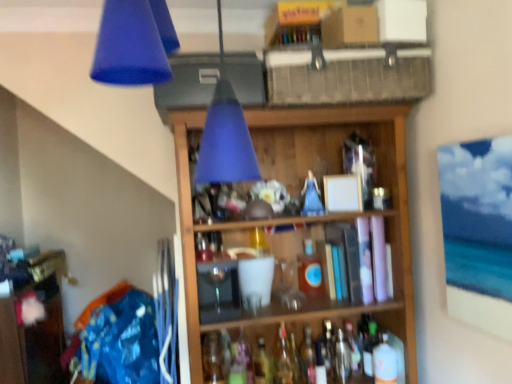
Question: Considering the relative positions of wooden shelf at center and translucent glass wine bottle at center, which appears as the 4th wine bottle when viewed from the right, in the image provided, is wooden shelf at center to the right of translucent glass wine bottle at center, which appears as the 4th wine bottle when viewed from the right, from the viewer's perspective?

Choices:
 (A) no
 (B) yes

Answer: (B)

Question: Does wooden shelf at center turn towards translucent glass wine bottle at center, which appears as the 4th wine bottle when viewed from the right?

Choices:
 (A) no
 (B) yes

Answer: (B)

Question: From the image's perspective, is wooden shelf at center over translucent glass wine bottle at center, the 1th wine bottle viewed from the left?

Choices:
 (A) yes
 (B) no

Answer: (A)

Question: Can you confirm if wooden shelf at center is thinner than translucent glass wine bottle at center, which appears as the 4th wine bottle when viewed from the right?

Choices:
 (A) yes
 (B) no

Answer: (B)

Question: From a real-world perspective, does wooden shelf at center stand above translucent glass wine bottle at center, which appears as the 4th wine bottle when viewed from the right?

Choices:
 (A) yes
 (B) no

Answer: (A)

Question: Is point (330, 377) positioned closer to the camera than point (365, 362)?

Choices:
 (A) closer
 (B) farther

Answer: (A)

Question: Considering the positions of translucent glass bottle at center, the third bottle viewed from the right, and translucent plastic bottle at center-right, acting as the 2th bottle starting from the right, in the image, is translucent glass bottle at center, the third bottle viewed from the right, taller or shorter than translucent plastic bottle at center-right, acting as the 2th bottle starting from the right,?

Choices:
 (A) tall
 (B) short

Answer: (A)

Question: From the image's perspective, relative to translucent plastic bottle at center-right, acting as the fifth bottle starting from the left, is translucent glass bottle at center, which is counted as the fourth bottle, starting from the left, above or below?

Choices:
 (A) below
 (B) above

Answer: (A)

Question: Choose the correct answer: Is translucent glass bottle at center, the third bottle viewed from the right, inside translucent plastic bottle at center-right, acting as the 2th bottle starting from the right, or outside it?

Choices:
 (A) inside
 (B) outside

Answer: (B)

Question: Considering the positions of wooden shelf at center and translucent glass bottle at center, the second bottle when ordered from left to right, in the image, is wooden shelf at center bigger or smaller than translucent glass bottle at center, the second bottle when ordered from left to right,?

Choices:
 (A) small
 (B) big

Answer: (B)

Question: In the image, is wooden shelf at center positioned in front of or behind translucent glass bottle at center, placed as the 5th bottle when sorted from right to left?

Choices:
 (A) front
 (B) behind

Answer: (A)

Question: From the image's perspective, is wooden shelf at center positioned above or below translucent glass bottle at center, placed as the 5th bottle when sorted from right to left?

Choices:
 (A) below
 (B) above

Answer: (B)

Question: From a real-world perspective, is wooden shelf at center positioned above or below translucent glass bottle at center, the second bottle when ordered from left to right?

Choices:
 (A) above
 (B) below

Answer: (A)

Question: Is translucent plastic bottle at lower right, the 1th bottle in the right-to-left sequence, in front of or behind translucent glass bottle at center, which is counted as the fourth bottle, starting from the left, in the image?

Choices:
 (A) behind
 (B) front

Answer: (B)

Question: From the image's perspective, is translucent plastic bottle at lower right, the sixth bottle viewed from the left, located above or below translucent glass bottle at center, which is counted as the fourth bottle, starting from the left?

Choices:
 (A) above
 (B) below

Answer: (A)